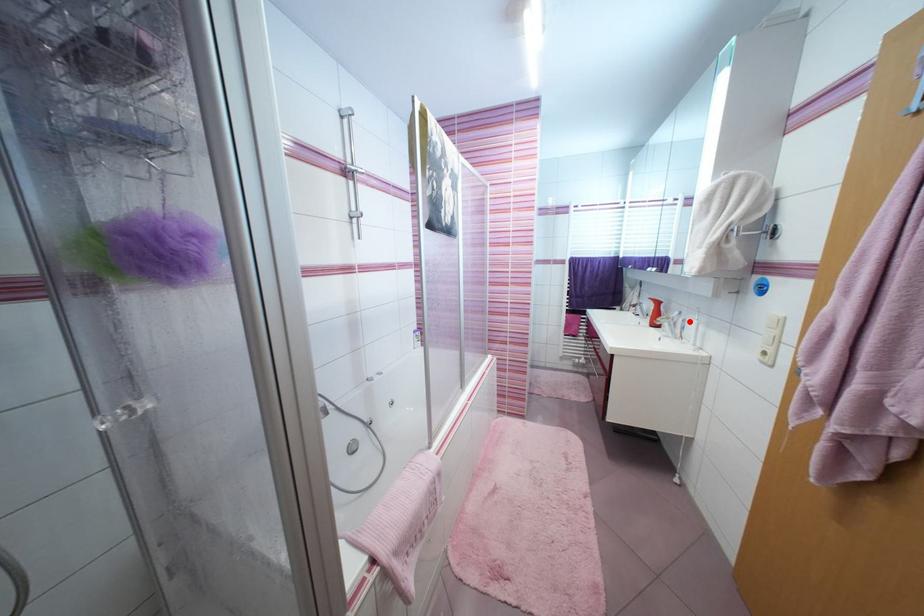
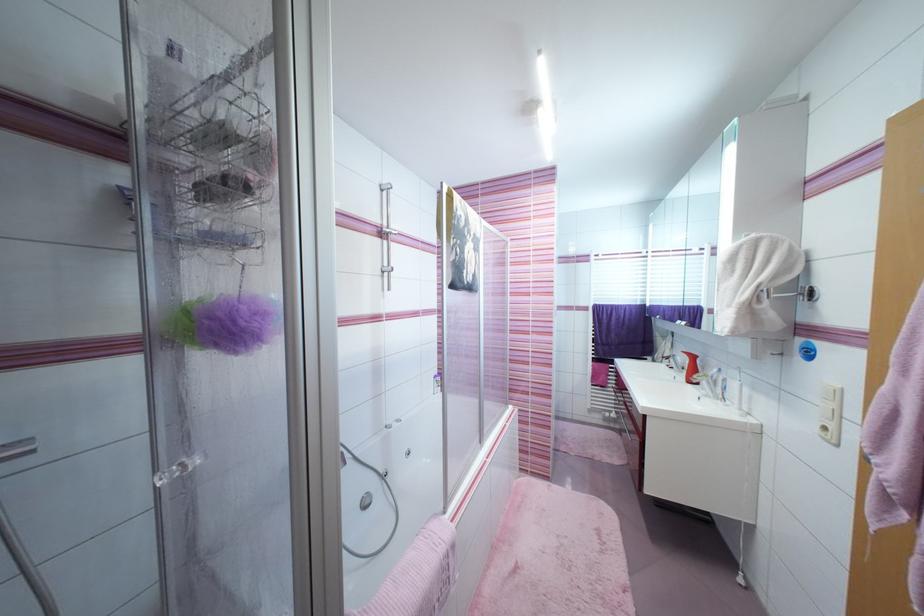
The point at the highlighted location is marked in the first image. Where is the corresponding point in the second image?

(730, 381)